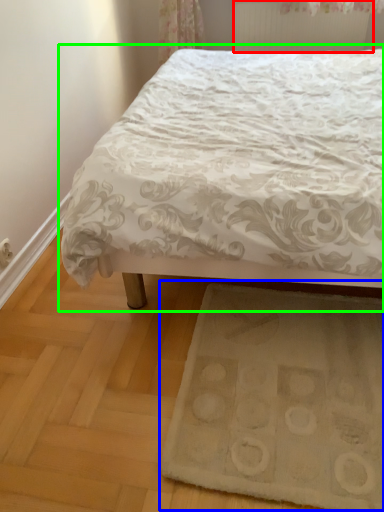
Question: Which is nearer to the radiator (highlighted by a red box)? doormat (highlighted by a blue box) or bed (highlighted by a green box).

Choices:
 (A) doormat
 (B) bed

Answer: (B)